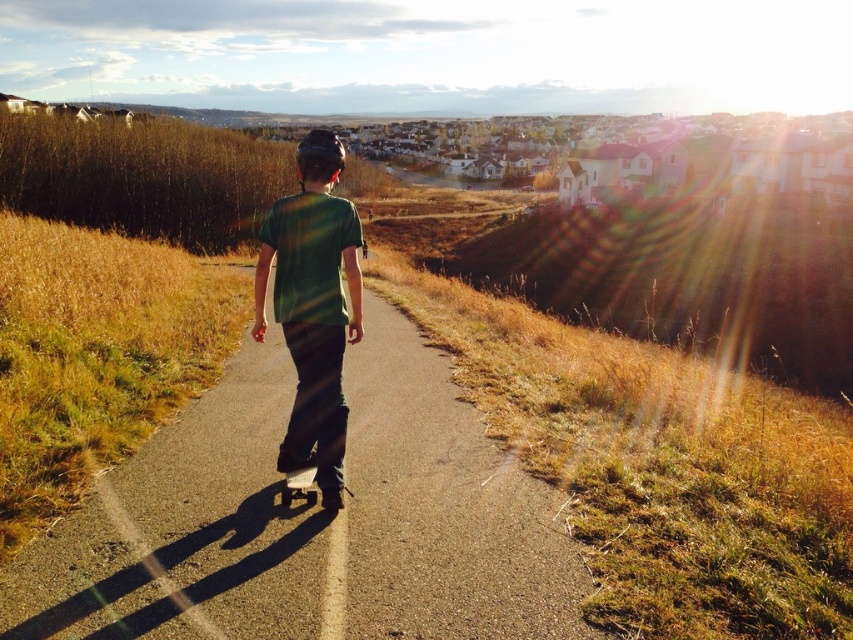
Measure the distance between point [305,376] and camera.

Point [305,376] and camera are 15.19 feet apart.

Which is below, green matte shirt at center or black matte skateboard at center?

Positioned lower is black matte skateboard at center.

Locate an element on the screen. The height and width of the screenshot is (640, 853). green matte shirt at center is located at coordinates (312, 305).

How distant is smooth asphalt road at center from black matte skateboard at center?

smooth asphalt road at center is 12.35 inches away from black matte skateboard at center.

Who is higher up, smooth asphalt road at center or black matte skateboard at center?

Positioned higher is black matte skateboard at center.

Based on the photo, who is more forward, (419, 548) or (282, 488)?

Point (419, 548) is more forward.

Locate an element on the screen. The image size is (853, 640). smooth asphalt road at center is located at coordinates [x=310, y=522].

Can you confirm if smooth asphalt road at center is taller than green matte shirt at center?

Incorrect, smooth asphalt road at center's height is not larger of green matte shirt at center's.

Is smooth asphalt road at center above green matte shirt at center?

No, smooth asphalt road at center is not above green matte shirt at center.

The height and width of the screenshot is (640, 853). Describe the element at coordinates (310, 522) in the screenshot. I see `smooth asphalt road at center` at that location.

Where is `smooth asphalt road at center`? The width and height of the screenshot is (853, 640). smooth asphalt road at center is located at coordinates (310, 522).